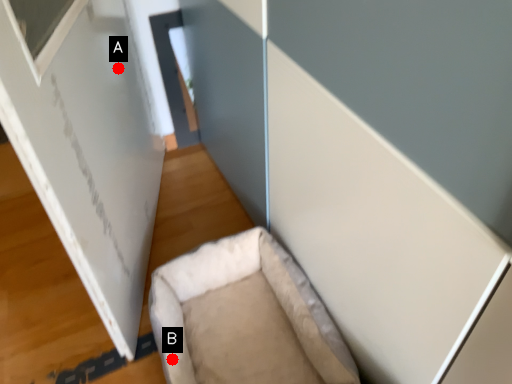
Question: Two points are circled on the image, labeled by A and B beside each circle. Which point is farther from the camera taking this photo?

Choices:
 (A) A is further
 (B) B is further

Answer: (A)